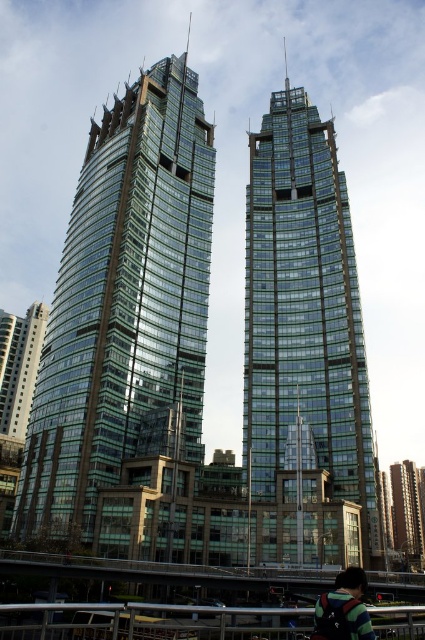
Question: Which object is closer to the camera taking this photo?

Choices:
 (A) glassy metallic skyscraper at center
 (B) transparent glass skyscraper at center

Answer: (A)

Question: Does transparent glass skyscraper at center have a lesser width compared to green glass building at lower right?

Choices:
 (A) no
 (B) yes

Answer: (B)

Question: Where is glassy metallic skyscraper at center located in relation to transparent glass skyscraper at center in the image?

Choices:
 (A) left
 (B) right

Answer: (A)

Question: Is glassy metallic skyscraper at center further to camera compared to dark green backpack at lower right?

Choices:
 (A) yes
 (B) no

Answer: (A)

Question: Which is nearer to the glassy metallic skyscraper at center?

Choices:
 (A) metal/rustic rail at lower center
 (B) green glass building at lower left
 (C) dark green backpack at lower right

Answer: (A)

Question: Which of the following is the farthest from the observer?

Choices:
 (A) (201, 284)
 (B) (297, 307)
 (C) (17, 356)
 (D) (357, 568)

Answer: (C)